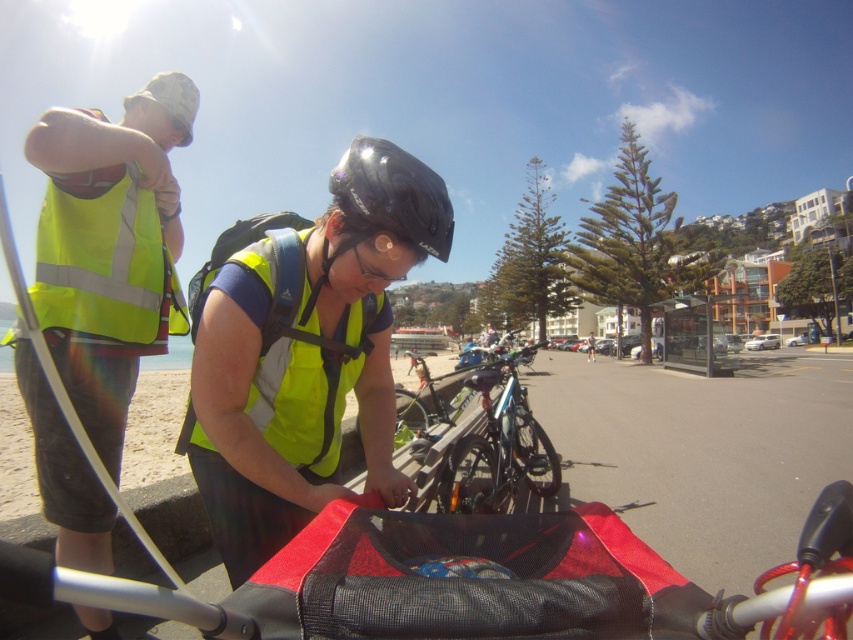
You are a delivery person who needs to park your shiny blue bike at center and glossy black helmet at center near a narrow alleyway that is only 1.2 meters wide. Can both items fit side by side in the alleyway without overlapping?

The shiny blue bike at center might be wider than glossy black helmet at center. Since the alleyway is only 1.2 meters wide, it is uncertain if both items can fit side by side without overlapping. The width of the bike compared to the helmet determines this, but the exact dimensions aren

You are standing at the beach and want to take a photo that includes both the point at coordinates point (318, 417) and point (407, 209). Which point should you focus on first to ensure both are in focus?

You should focus on point (407, 209) first because it is closer to you than point (318, 417), which is further away. This ensures the closer point is in focus, and the further point may also be within the depth of field.

You are planning to take a photo of the high visibility yellow vest at left and the shiny blue bike at center. Which object should you focus on first if you want to ensure both are in the frame without moving the camera? Explain your reasoning based on their sizes.

The high visibility yellow vest at left is narrower than the shiny blue bike at center. To include both in the frame, focus on centering the wider shiny blue bike at center first, then adjust slightly to include the smaller high visibility yellow vest at left without moving the camera.